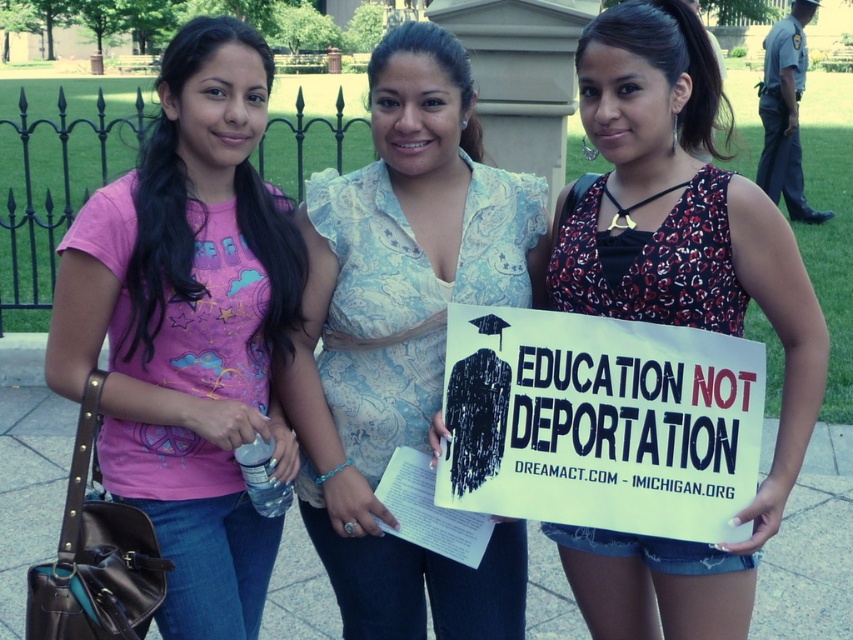
Question: Can you confirm if matte pink t-shirt at left is wider than light blue paisley blouse at center?

Choices:
 (A) no
 (B) yes

Answer: (A)

Question: Which of the following is the closest to the observer?

Choices:
 (A) light blue paisley blouse at center
 (B) matte pink t-shirt at left

Answer: (B)

Question: Can you confirm if matte pink t-shirt at left is smaller than floral dress at center?

Choices:
 (A) yes
 (B) no

Answer: (A)

Question: Based on their relative distances, which object is nearer to the floral dress at center?

Choices:
 (A) matte pink t-shirt at left
 (B) light blue paisley blouse at center

Answer: (B)

Question: Which object appears closest to the camera in this image?

Choices:
 (A) floral dress at center
 (B) matte pink t-shirt at left

Answer: (A)

Question: Can you confirm if light blue paisley blouse at center is thinner than floral dress at center?

Choices:
 (A) no
 (B) yes

Answer: (A)